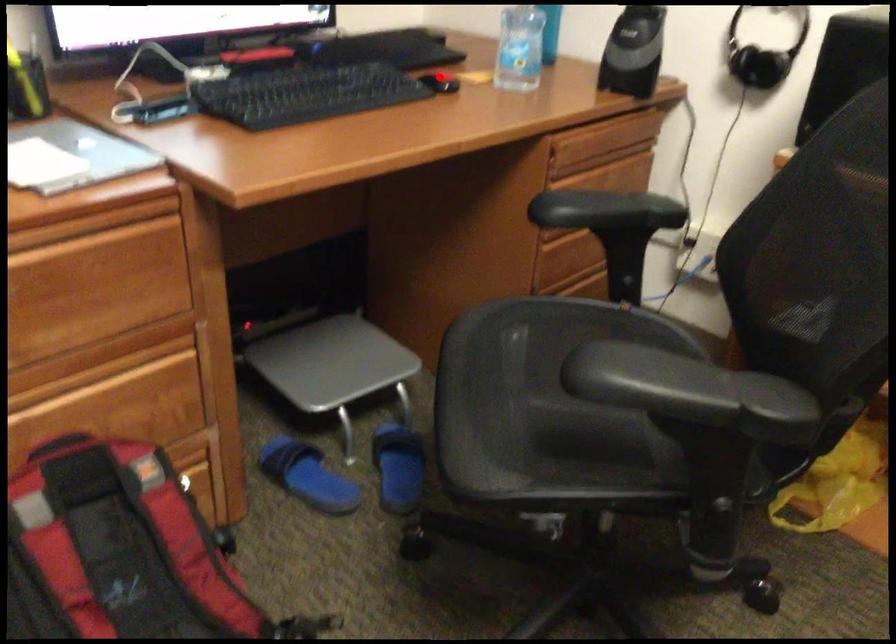
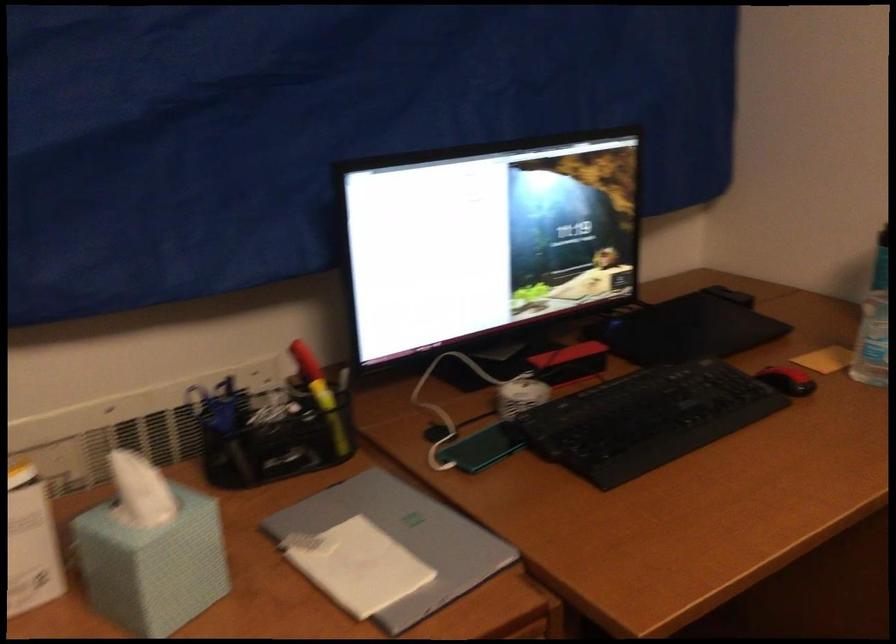
Find the pixel in the second image that matches the highlighted location in the first image.

(787, 380)